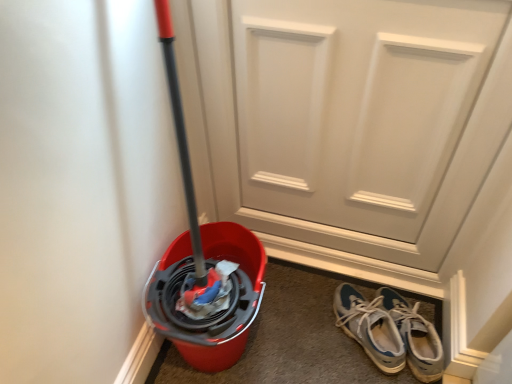
You are a GUI agent. You are given a task and a screenshot of the screen. Output one action in this format:
    pyautogui.click(x=<x>, y=<y>)
    Task: Click on the free point behind blue suede sneakers at lower right
    Image resolution: width=512 pixels, height=384 pixels.
    Given the screenshot: What is the action you would take?
    pyautogui.click(x=340, y=277)